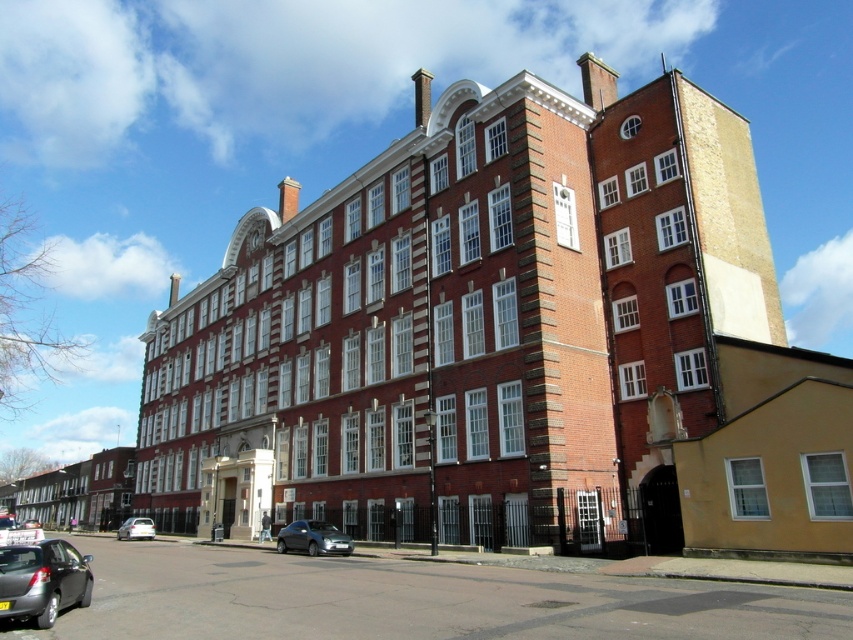
Who is shorter, matte black car at lower left or white matte car at lower left?

white matte car at lower left

Does point (32, 605) come behind point (137, 518)?

No, it is not.

Is point (83, 593) in front of point (125, 524)?

Yes, point (83, 593) is closer to viewer.

Identify the location of matte black car at lower left. (42, 580).

Can you confirm if matte black car at lower left is shorter than satin silver car at lower center?

Incorrect, matte black car at lower left's height does not fall short of satin silver car at lower center's.

Who is shorter, matte black car at lower left or satin silver car at lower center?

satin silver car at lower center

Who is more distant from viewer, [32,620] or [331,538]?

Positioned behind is point [331,538].

I want to click on matte black car at lower left, so click(42, 580).

Is satin silver car at lower center smaller than white matte car at lower left?

Correct, satin silver car at lower center occupies less space than white matte car at lower left.

Between satin silver car at lower center and white matte car at lower left, which one is positioned higher?

satin silver car at lower center is higher up.

In the scene shown: Who is more distant from viewer, [323,547] or [131,532]?

Positioned behind is point [131,532].

The width and height of the screenshot is (853, 640). Identify the location of satin silver car at lower center. (312, 538).